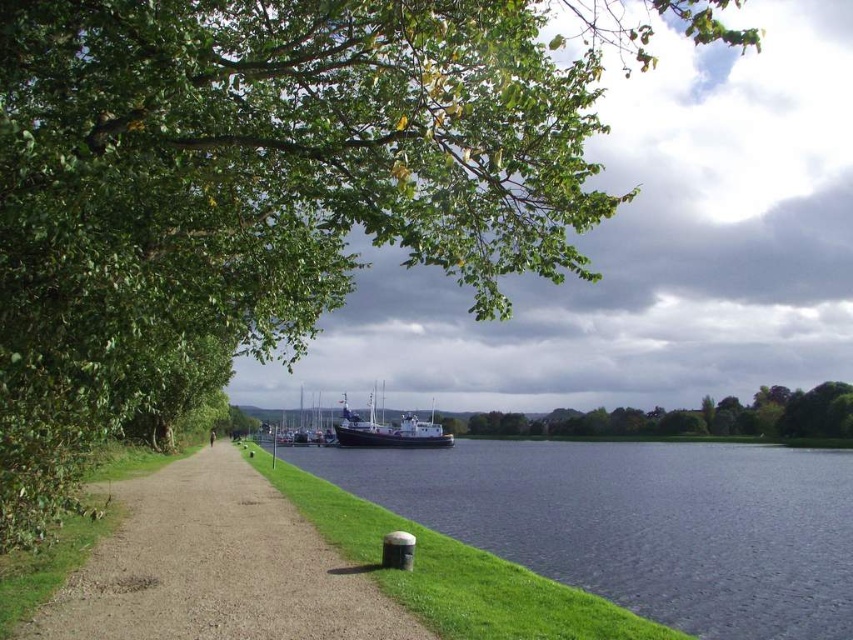
You are standing at the point closer to the camera in the image. Which point are you at, point (757, 513) or point (149, 556)?

You are at point (757, 513) because it is further to the camera than point (149, 556).

You are standing at the point marked by the coordinates (694,417) in the image. Looking around, you see a green leafy tree at center. Which direction would you face to look towards the path that curves to the right?

The point marked by the coordinates (694,417) is at the green leafy tree at center. The path curves to the right and is located to the left side of the frame. Therefore, facing towards the left would orient you towards the path that curves to the right.

You are standing on the riverside path and want to take a photo of both the green leafy tree at center and the metallic blue boat at center. Which object should you focus on first to ensure both are in the same frame?

You should focus on the green leafy tree at center first since it is closer to you than the metallic blue boat at center, allowing both to be captured in the same frame.